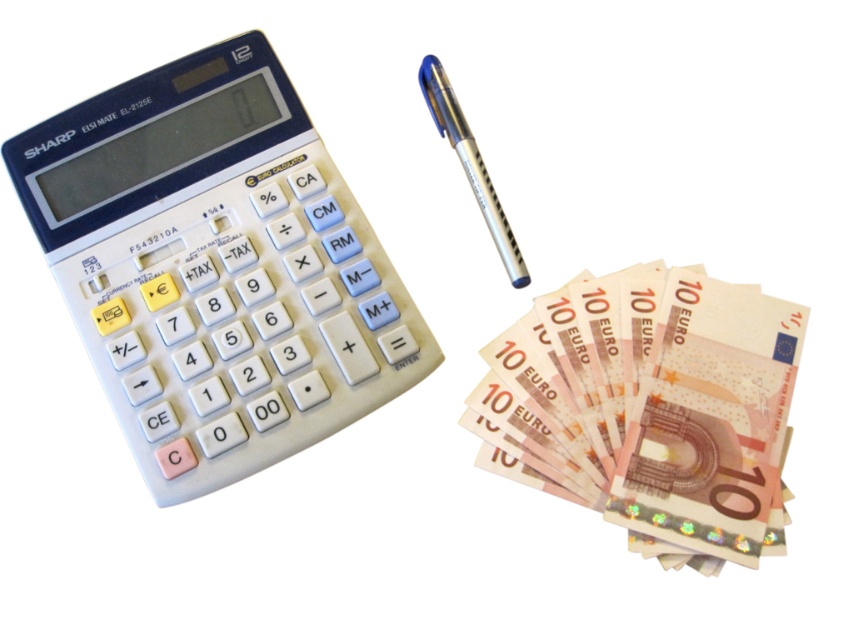
Question: Which of the following is the farthest from the observer?

Choices:
 (A) (640, 442)
 (B) (373, 273)

Answer: (B)

Question: Estimate the real-world distances between objects in this image. Which object is closer to the silver metallic pen at upper center?

Choices:
 (A) white plastic calculator at left
 (B) light pink paper money at right

Answer: (B)

Question: Does white plastic calculator at left have a larger size compared to light pink paper money at right?

Choices:
 (A) yes
 (B) no

Answer: (A)

Question: Estimate the real-world distances between objects in this image. Which object is farther from the light pink paper money at right?

Choices:
 (A) white plastic calculator at left
 (B) silver metallic pen at upper center

Answer: (A)

Question: Does white plastic calculator at left appear under silver metallic pen at upper center?

Choices:
 (A) no
 (B) yes

Answer: (B)

Question: Is white plastic calculator at left below silver metallic pen at upper center?

Choices:
 (A) no
 (B) yes

Answer: (B)